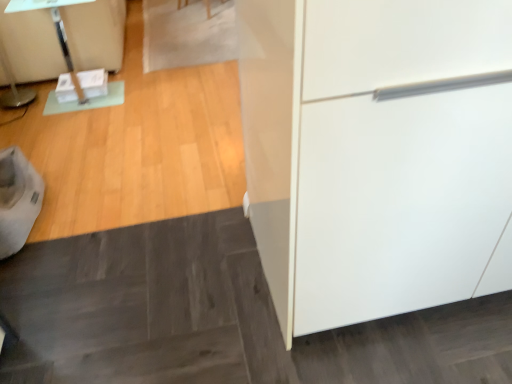
You are a GUI agent. You are given a task and a screenshot of the screen. Output one action in this format:
    pyautogui.click(x=<x>, y=<y>)
    Task: Click on the clear glass table at upper left
    The image size is (512, 384).
    Given the screenshot: What is the action you would take?
    pyautogui.click(x=96, y=34)

The image size is (512, 384). What do you see at coordinates (96, 34) in the screenshot?
I see `clear glass table at upper left` at bounding box center [96, 34].

The width and height of the screenshot is (512, 384). Identify the location of clear glass table at upper left. (96, 34).